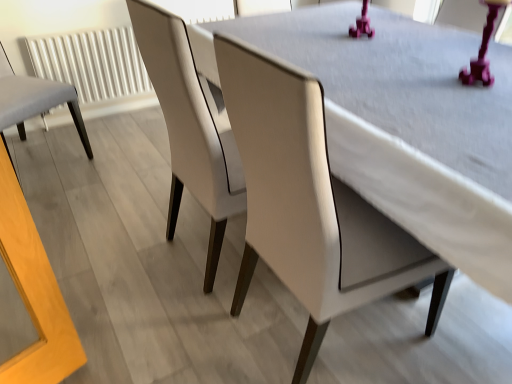
How much space does matte white chair at center, placed as the second chair when sorted from right to left, occupy vertically?

matte white chair at center, placed as the second chair when sorted from right to left, is 3.48 feet tall.

You are a GUI agent. You are given a task and a screenshot of the screen. Output one action in this format:
    pyautogui.click(x=<x>, y=<y>)
    Task: Click on the white leather chair at center, positioned as the third chair in left-to-right order
    The height and width of the screenshot is (384, 512).
    Given the screenshot: What is the action you would take?
    pyautogui.click(x=191, y=116)

What is the approximate width of white leather chair at center, positioned as the third chair in left-to-right order?

white leather chair at center, positioned as the third chair in left-to-right order, is 4.13 feet in width.

Image resolution: width=512 pixels, height=384 pixels. What do you see at coordinates (35, 100) in the screenshot? I see `light gray fabric chair at left, the 1th chair in the left-to-right sequence` at bounding box center [35, 100].

The height and width of the screenshot is (384, 512). What are the coordinates of `matte white chair at center, placed as the second chair when sorted from right to left` in the screenshot? It's located at (191, 125).

Locate an element on the screen. The image size is (512, 384). chair that appears on the left of white textured radiator at left is located at coordinates (35, 100).

From the image's perspective, which object appears higher, light gray fabric chair at left, which appears as the third chair when viewed from the right, or white textured radiator at left?

From the image's view, white textured radiator at left is above.

Can you confirm if light gray fabric chair at left, the 1th chair in the left-to-right sequence, is shorter than white textured radiator at left?

No.

Can you confirm if light gray fabric chair at left, which appears as the third chair when viewed from the right, is positioned to the left of white textured radiator at left?

Yes, light gray fabric chair at left, which appears as the third chair when viewed from the right, is to the left of white textured radiator at left.

Measure the distance between white leather chair at center, the 1th chair in the right-to-left sequence, and light gray fabric chair at left, which appears as the third chair when viewed from the right.

white leather chair at center, the 1th chair in the right-to-left sequence, and light gray fabric chair at left, which appears as the third chair when viewed from the right, are 3.52 feet apart from each other.

From a real-world perspective, is white leather chair at center, positioned as the third chair in left-to-right order, above or below light gray fabric chair at left, which appears as the third chair when viewed from the right?

white leather chair at center, positioned as the third chair in left-to-right order, is situated lower than light gray fabric chair at left, which appears as the third chair when viewed from the right, in the real world.

Looking at this image, considering the positions of objects white leather chair at center, positioned as the third chair in left-to-right order, and light gray fabric chair at left, the 1th chair in the left-to-right sequence, in the image provided, who is behind, white leather chair at center, positioned as the third chair in left-to-right order, or light gray fabric chair at left, the 1th chair in the left-to-right sequence,?

light gray fabric chair at left, the 1th chair in the left-to-right sequence, is more distant.

Is white leather chair at center, positioned as the third chair in left-to-right order, smaller than light gray fabric chair at left, the 1th chair in the left-to-right sequence?

Actually, white leather chair at center, positioned as the third chair in left-to-right order, might be larger than light gray fabric chair at left, the 1th chair in the left-to-right sequence.

In the scene shown: Is matte white chair at center, arranged as the 2th chair when viewed from the left, positioned far away from light gray fabric chair at left, the 1th chair in the left-to-right sequence?

No.

Which of these two, matte white chair at center, placed as the second chair when sorted from right to left, or light gray fabric chair at left, which appears as the third chair when viewed from the right, stands shorter?

light gray fabric chair at left, which appears as the third chair when viewed from the right, is shorter.

Find the location of a particular element. The height and width of the screenshot is (384, 512). the 1st chair to the right when counting from the light gray fabric chair at left, which appears as the third chair when viewed from the right is located at coordinates pos(191,125).

From the image's perspective, is matte white chair at center, arranged as the 2th chair when viewed from the left, above or below light gray fabric chair at left, which appears as the third chair when viewed from the right?

matte white chair at center, arranged as the 2th chair when viewed from the left, is situated lower than light gray fabric chair at left, which appears as the third chair when viewed from the right, in the image.

Is white textured radiator at left placed right next to light gray fabric chair at left, the 1th chair in the left-to-right sequence?

white textured radiator at left and light gray fabric chair at left, the 1th chair in the left-to-right sequence, are not in contact.

Is white textured radiator at left oriented towards light gray fabric chair at left, which appears as the third chair when viewed from the right?

Yes, white textured radiator at left is aimed at light gray fabric chair at left, which appears as the third chair when viewed from the right.

Is white textured radiator at left wider or thinner than light gray fabric chair at left, which appears as the third chair when viewed from the right?

In the image, white textured radiator at left appears to be more narrow than light gray fabric chair at left, which appears as the third chair when viewed from the right.

Which of these two, white leather chair at center, the 1th chair in the right-to-left sequence, or white textured radiator at left, is smaller?

white textured radiator at left.

From a real-world perspective, who is located lower, white leather chair at center, the 1th chair in the right-to-left sequence, or white textured radiator at left?

From a 3D spatial view, white textured radiator at left is below.

Considering the relative sizes of white leather chair at center, the 1th chair in the right-to-left sequence, and white textured radiator at left in the image provided, is white leather chair at center, the 1th chair in the right-to-left sequence, wider than white textured radiator at left?

Yes.

Who is more distant, light gray fabric chair at left, the 1th chair in the left-to-right sequence, or matte white chair at center, placed as the second chair when sorted from right to left?

light gray fabric chair at left, the 1th chair in the left-to-right sequence.

Based on their sizes in the image, would you say light gray fabric chair at left, which appears as the third chair when viewed from the right, is bigger or smaller than matte white chair at center, placed as the second chair when sorted from right to left?

light gray fabric chair at left, which appears as the third chair when viewed from the right, is bigger than matte white chair at center, placed as the second chair when sorted from right to left.

From a real-world perspective, relative to matte white chair at center, placed as the second chair when sorted from right to left, is light gray fabric chair at left, which appears as the third chair when viewed from the right, vertically above or below?

In terms of real-world spatial position, light gray fabric chair at left, which appears as the third chair when viewed from the right, is below matte white chair at center, placed as the second chair when sorted from right to left.

Is matte white chair at center, arranged as the 2th chair when viewed from the left, inside light gray fabric chair at left, which appears as the third chair when viewed from the right?

No, matte white chair at center, arranged as the 2th chair when viewed from the left, is not a part of light gray fabric chair at left, which appears as the third chair when viewed from the right.

At what (x,y) coordinates should I click in order to perform the action: click on the 2nd chair to the right when counting from the white textured radiator at left. Please return your answer as a coordinate pair (x, y). The image size is (512, 384). Looking at the image, I should click on (191, 116).

Between white textured radiator at left and white leather chair at center, positioned as the third chair in left-to-right order, which one has smaller size?

Smaller between the two is white textured radiator at left.

From a real-world perspective, is white textured radiator at left on top of white leather chair at center, the 1th chair in the right-to-left sequence?

Incorrect, from a real-world perspective, white textured radiator at left is lower than white leather chair at center, the 1th chair in the right-to-left sequence.

Considering the relative positions of white textured radiator at left and white leather chair at center, the 1th chair in the right-to-left sequence, in the image provided, is white textured radiator at left behind white leather chair at center, the 1th chair in the right-to-left sequence,?

Answer: Yes, the depth of white textured radiator at left is greater than that of white leather chair at center, the 1th chair in the right-to-left sequence.

I want to click on chair that is the 1st object located below the white textured radiator at left (from the image's perspective), so click(35, 100).

Where is `chair that is the 2nd object to the left of the white leather chair at center, the 1th chair in the right-to-left sequence, starting at the anchor`? The width and height of the screenshot is (512, 384). chair that is the 2nd object to the left of the white leather chair at center, the 1th chair in the right-to-left sequence, starting at the anchor is located at coordinates (35, 100).

When comparing their distances from white textured radiator at left, does light gray fabric chair at left, the 1th chair in the left-to-right sequence, or matte white chair at center, placed as the second chair when sorted from right to left, seem further?

matte white chair at center, placed as the second chair when sorted from right to left, lies further to white textured radiator at left than the other object.

Looking at the image, which one is located further to white leather chair at center, positioned as the third chair in left-to-right order, light gray fabric chair at left, which appears as the third chair when viewed from the right, or white textured radiator at left?

white textured radiator at left lies further to white leather chair at center, positioned as the third chair in left-to-right order, than the other object.

Considering their positions, is matte white chair at center, arranged as the 2th chair when viewed from the left, positioned further to white leather chair at center, the 1th chair in the right-to-left sequence, than white textured radiator at left?

white textured radiator at left.

Based on their spatial positions, is light gray fabric chair at left, which appears as the third chair when viewed from the right, or white textured radiator at left further from matte white chair at center, placed as the second chair when sorted from right to left?

white textured radiator at left is further to matte white chair at center, placed as the second chair when sorted from right to left.

From the image, which object appears to be farther from white leather chair at center, positioned as the third chair in left-to-right order, white textured radiator at left or light gray fabric chair at left, the 1th chair in the left-to-right sequence?

The object further to white leather chair at center, positioned as the third chair in left-to-right order, is white textured radiator at left.

Looking at this image, when comparing their distances from light gray fabric chair at left, which appears as the third chair when viewed from the right, does white textured radiator at left or white leather chair at center, the 1th chair in the right-to-left sequence, seem further?

Based on the image, white leather chair at center, the 1th chair in the right-to-left sequence, appears to be further to light gray fabric chair at left, which appears as the third chair when viewed from the right.

Which object lies nearer to the anchor point light gray fabric chair at left, which appears as the third chair when viewed from the right, white textured radiator at left or matte white chair at center, placed as the second chair when sorted from right to left?

white textured radiator at left.

Looking at the image, which one is located closer to white leather chair at center, positioned as the third chair in left-to-right order, matte white chair at center, placed as the second chair when sorted from right to left, or light gray fabric chair at left, which appears as the third chair when viewed from the right?

matte white chair at center, placed as the second chair when sorted from right to left.

Locate an element on the screen. radiator between light gray fabric chair at left, the 1th chair in the left-to-right sequence, and white leather chair at center, the 1th chair in the right-to-left sequence is located at coordinates (94, 67).

What are the coordinates of `chair between matte white chair at center, arranged as the 2th chair when viewed from the left, and white textured radiator at left from front to back` in the screenshot? It's located at (35, 100).

The width and height of the screenshot is (512, 384). I want to click on chair between light gray fabric chair at left, the 1th chair in the left-to-right sequence, and white leather chair at center, positioned as the third chair in left-to-right order, from left to right, so click(191, 125).